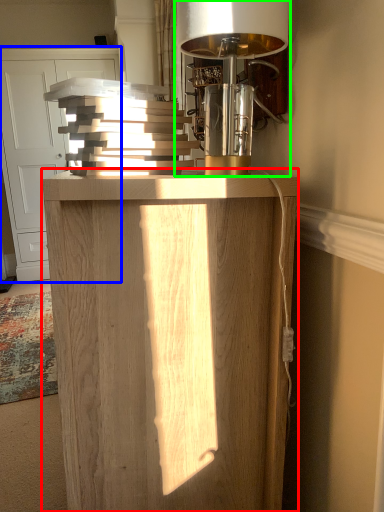
Question: Based on their relative distances, which object is farther from furniture (highlighted by a red box)? Choose from cabinetry (highlighted by a blue box) and table lamp (highlighted by a green box).

Choices:
 (A) cabinetry
 (B) table lamp

Answer: (A)